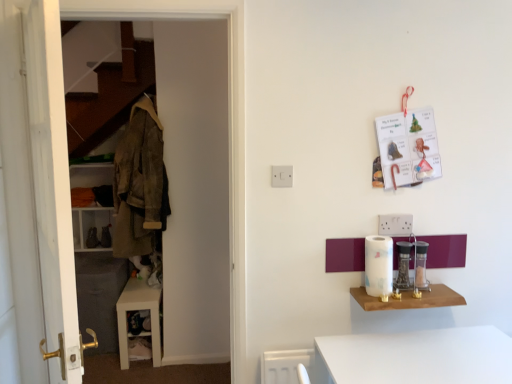
This screenshot has height=384, width=512. Describe the element at coordinates (410, 299) in the screenshot. I see `wooden shelf at lower right` at that location.

Find the location of `wooden shelf at lower right`. wooden shelf at lower right is located at coordinates (x=410, y=299).

Does point (357, 287) appear closer or farther from the camera than point (96, 231)?

Clearly, point (357, 287) is closer to the camera than point (96, 231).

Which of these two, wooden shelf at lower right or brown suede shoe at left, stands taller?

brown suede shoe at left is taller.

Is wooden shelf at lower right placed right next to brown suede shoe at left?

No, wooden shelf at lower right is not in contact with brown suede shoe at left.

Based on the photo, from a real-world perspective, who is located higher, wooden shelf at lower right or brown suede shoe at left?

In real-world perspective, wooden shelf at lower right is above.

From the image's perspective, is brown corduroy jacket at left located above white glossy paper towel holder at right, which appears as the second appliance when viewed from the right?

Yes, from the image's perspective, brown corduroy jacket at left is over white glossy paper towel holder at right, which appears as the second appliance when viewed from the right.

Is brown corduroy jacket at left facing towards white glossy paper towel holder at right, which appears as the second appliance when viewed from the right?

No, brown corduroy jacket at left is not aimed at white glossy paper towel holder at right, which appears as the second appliance when viewed from the right.

Is brown corduroy jacket at left in contact with white glossy paper towel holder at right, which is the second appliance in left-to-right order?

No, brown corduroy jacket at left is not beside white glossy paper towel holder at right, which is the second appliance in left-to-right order.

Does brown corduroy jacket at left appear on the right side of white glossy paper towel holder at right, which appears as the second appliance when viewed from the right?

No.

Is white paper towel at right, which appears as the 1th appliance when viewed from the left, inside the boundaries of wooden shelf at lower right, or outside?

white paper towel at right, which appears as the 1th appliance when viewed from the left, is not inside wooden shelf at lower right, it's outside.

Can you tell me how much white paper towel at right, which appears as the 1th appliance when viewed from the left, and wooden shelf at lower right differ in facing direction?

0.519 degrees separate the facing orientations of white paper towel at right, which appears as the 1th appliance when viewed from the left, and wooden shelf at lower right.

From a real-world perspective, is white paper towel at right, which appears as the 1th appliance when viewed from the left, on wooden shelf at lower right?

Yes, from a real-world perspective, white paper towel at right, which appears as the 1th appliance when viewed from the left, is above wooden shelf at lower right.

Is white plastic electric outlet at center situated inside white glossy cabinet at lower left or outside?

white plastic electric outlet at center lies outside white glossy cabinet at lower left.

Is white plastic electric outlet at center aimed at white glossy cabinet at lower left?

No, white plastic electric outlet at center is not facing towards white glossy cabinet at lower left.

Who is bigger, white plastic electric outlet at center or white glossy cabinet at lower left?

Bigger between the two is white glossy cabinet at lower left.

Is white plastic electric outlet at center not close to white glossy cabinet at lower left?

Yes, white plastic electric outlet at center is far from white glossy cabinet at lower left.

From a real-world perspective, is white wooden dresser at left physically located above or below clear glass jar at right, which is the 3th appliance from left to right?

white wooden dresser at left is above clear glass jar at right, which is the 3th appliance from left to right.

Considering the sizes of objects white wooden dresser at left and clear glass jar at right, the first appliance from the right, in the image provided, who is shorter, white wooden dresser at left or clear glass jar at right, the first appliance from the right,?

clear glass jar at right, the first appliance from the right.

Is the position of white wooden dresser at left less distant than that of clear glass jar at right, which is the 3th appliance from left to right?

Yes, the depth of white wooden dresser at left is less than that of clear glass jar at right, which is the 3th appliance from left to right.

Does brown corduroy jacket at left appear on the right side of white paper towel at right, which appears as the 1th appliance when viewed from the left?

Incorrect, brown corduroy jacket at left is not on the right side of white paper towel at right, which appears as the 1th appliance when viewed from the left.

Could you tell me if brown corduroy jacket at left is turned towards white paper towel at right, which appears as the 3th appliance when viewed from the right?

No, brown corduroy jacket at left is not oriented towards white paper towel at right, which appears as the 3th appliance when viewed from the right.

Between brown corduroy jacket at left and white paper towel at right, which appears as the 1th appliance when viewed from the left, which one has larger width?

Wider between the two is brown corduroy jacket at left.

Which object is closer to the camera, white paper towel at right, which appears as the 1th appliance when viewed from the left, or brown corduroy jacket at left?

Positioned in front is white paper towel at right, which appears as the 1th appliance when viewed from the left.

From a real-world perspective, between white paper towel at right, which appears as the 3th appliance when viewed from the right, and brown corduroy jacket at left, who is vertically lower?

white paper towel at right, which appears as the 3th appliance when viewed from the right, is physically lower.

Which appliance is the 3rd one when counting from the front of the brown corduroy jacket at left? Please provide its 2D coordinates.

[(379, 265)]

Which point is more distant from viewer, (374, 241) or (140, 168)?

The point (140, 168) is behind.

Find the location of a particular element. The image size is (512, 384). shoe above the wooden shelf at lower right (from the image's perspective) is located at coordinates (92, 238).

There is a white glossy paper towel holder at right, which appears as the second appliance when viewed from the right. Identify the location of clothing above it (from a real-world perspective). (139, 182).

Looking at the image, which one is located further to white glossy cabinet at lower left, brown corduroy jacket at left or white wooden door at left?

white wooden door at left.

Based on their spatial positions, is white wooden dresser at left or wooden shelf at lower right further from white plastic electric outlet at center?

white wooden dresser at left is further to white plastic electric outlet at center.

Considering their positions, is white paper towel at right, which appears as the 3th appliance when viewed from the right, positioned further to clear glass jar at right, which is the 3th appliance from left to right, than wooden shelf at lower right?

The object further to clear glass jar at right, which is the 3th appliance from left to right, is white paper towel at right, which appears as the 3th appliance when viewed from the right.

From the image, which object appears to be nearer to clear glass jar at right, the first appliance from the right, white glossy paper towel holder at right, which is the second appliance in left-to-right order, or brown corduroy jacket at left?

white glossy paper towel holder at right, which is the second appliance in left-to-right order, lies closer to clear glass jar at right, the first appliance from the right, than the other object.

Which object lies nearer to the anchor point clear glass jar at right, which is the 3th appliance from left to right, white wooden dresser at left or brown suede shoe at left?

white wooden dresser at left lies closer to clear glass jar at right, which is the 3th appliance from left to right, than the other object.

Considering their positions, is clear glass jar at right, which is the 3th appliance from left to right, positioned further to white glossy cabinet at lower left than white wooden dresser at left?

Based on the image, clear glass jar at right, which is the 3th appliance from left to right, appears to be further to white glossy cabinet at lower left.

Estimate the real-world distances between objects in this image. Which object is further from white wooden dresser at left, white plastic electric outlet at center or white glossy cabinet at lower left?

The object further to white wooden dresser at left is white plastic electric outlet at center.

Estimate the real-world distances between objects in this image. Which object is further from white plastic electric outlet at center, white wooden door at left or clear glass jar at right, which is the 3th appliance from left to right?

white wooden door at left lies further to white plastic electric outlet at center than the other object.

At what (x,y) coordinates should I click in order to perform the action: click on dresser between brown corduroy jacket at left and wooden shelf at lower right. Please return your answer as a coordinate pair (x, y). Image resolution: width=512 pixels, height=384 pixels. Looking at the image, I should click on (194, 185).

This screenshot has height=384, width=512. Find the location of `dresser between white glossy cabinet at lower left and white paper towel at right, which appears as the 3th appliance when viewed from the right, from left to right`. dresser between white glossy cabinet at lower left and white paper towel at right, which appears as the 3th appliance when viewed from the right, from left to right is located at coordinates (194, 185).

At what (x,y) coordinates should I click in order to perform the action: click on electric outlet located between brown suede shoe at left and clear glass jar at right, the first appliance from the right, in the left-right direction. Please return your answer as a coordinate pair (x, y). This screenshot has height=384, width=512. Looking at the image, I should click on (282, 176).

The height and width of the screenshot is (384, 512). What are the coordinates of `clothing that lies between white plastic electric outlet at center and white glossy cabinet at lower left from top to bottom` in the screenshot? It's located at (139, 182).